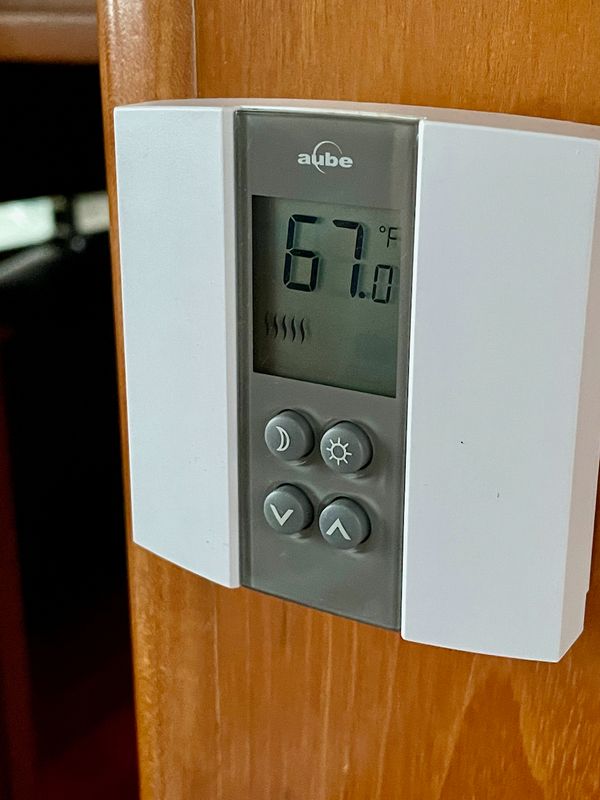
Locate an element on the screen. The height and width of the screenshot is (800, 600). thermostat display is located at coordinates (352, 332).